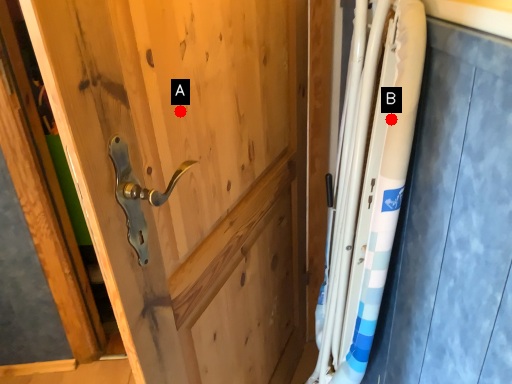
Question: Two points are circled on the image, labeled by A and B beside each circle. Which of the following is the closest to the observer?

Choices:
 (A) A is closer
 (B) B is closer

Answer: (A)